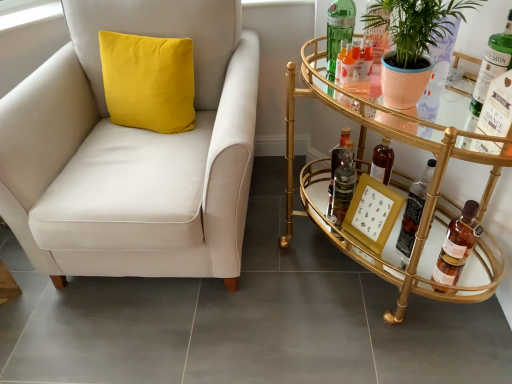
Question: Is green glass bottle at upper right, acting as the 5th bottle starting from the left, to the left or to the right of translucent glass bottle at center in the image?

Choices:
 (A) left
 (B) right

Answer: (B)

Question: From their relative heights in the image, would you say green glass bottle at upper right, acting as the 2th bottle starting from the right, is taller or shorter than translucent glass bottle at center?

Choices:
 (A) short
 (B) tall

Answer: (B)

Question: Which object is the farthest from the green glass bottle at upper right, positioned as the 6th bottle in right-to-left order?

Choices:
 (A) green glass bottle at upper right, acting as the 5th bottle starting from the left
 (B) matte white armchair at center
 (C) matte peach pot at right
 (D) gold mirrored bar cart at right
 (E) brown glass bottle at lower right, which appears as the first bottle when viewed from the right

Answer: (B)

Question: Considering the real-world distances, which object is farthest from the green glass bottle at upper right, the 5th bottle from the right?

Choices:
 (A) translucent glass bottle at lower right, arranged as the 3th bottle when viewed from the right
 (B) translucent glass bottle at right, which is the third bottle in left-to-right order
 (C) matte white armchair at center
 (D) matte peach pot at right
 (E) translucent glass bottle at center

Answer: (C)